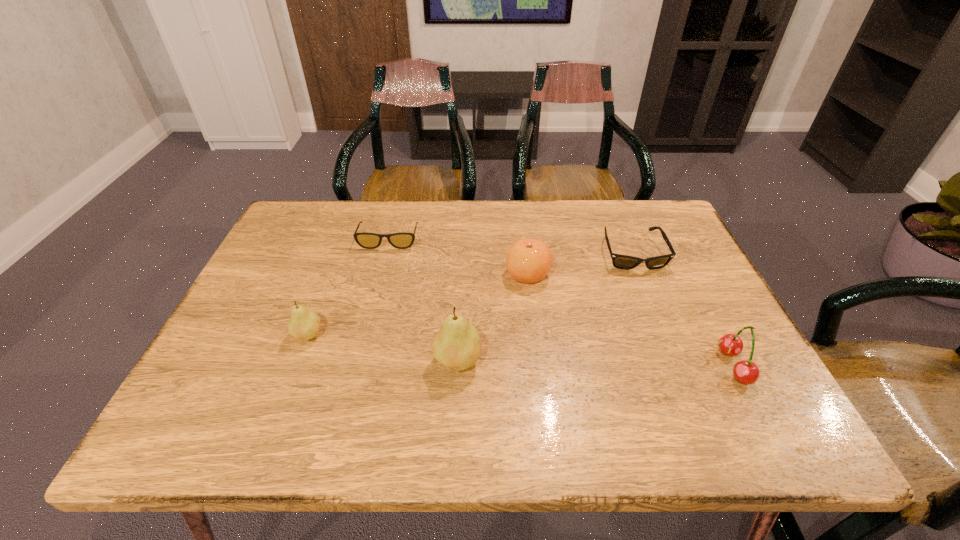
This screenshot has width=960, height=540. I want to click on free space between the left sunglasses and the fourth object from left to right, so click(459, 256).

You are a GUI agent. You are given a task and a screenshot of the screen. Output one action in this format:
    pyautogui.click(x=<x>, y=<y>)
    Task: Click on the free space between the second object from left to right and the right pear
    The height and width of the screenshot is (540, 960).
    Given the screenshot: What is the action you would take?
    pyautogui.click(x=423, y=300)

You are a GUI agent. You are given a task and a screenshot of the screen. Output one action in this format:
    pyautogui.click(x=<x>, y=<y>)
    Task: Click on the free space between the third object from left to right and the cherry
    The width and height of the screenshot is (960, 540).
    Given the screenshot: What is the action you would take?
    pyautogui.click(x=595, y=363)

Where is `vacant area that lies between the left pear and the tallest object`? Image resolution: width=960 pixels, height=540 pixels. vacant area that lies between the left pear and the tallest object is located at coordinates (382, 348).

You are a GUI agent. You are given a task and a screenshot of the screen. Output one action in this format:
    pyautogui.click(x=<x>, y=<y>)
    Task: Click on the free space between the fifth object from left to right and the cherry
    
    Given the screenshot: What is the action you would take?
    pyautogui.click(x=683, y=309)

The height and width of the screenshot is (540, 960). Identify the location of blank region between the leftmost object and the second object from right to left. (470, 294).

Where is `empty space that is in between the left pear and the third object from right to left`? The height and width of the screenshot is (540, 960). empty space that is in between the left pear and the third object from right to left is located at coordinates (418, 305).

Find the location of a particular element. blank region between the left sunglasses and the third object from right to left is located at coordinates (459, 256).

Locate which object ranks in proximity to the shorter pear. Please provide its 2D coordinates. Your answer should be formatted as a tuple, i.e. [(x, y)], where the tuple contains the x and y coordinates of a point satisfying the conditions above.

[(457, 346)]

The width and height of the screenshot is (960, 540). In order to click on object that can be found as the second closest to the second object from right to left in this screenshot , I will do `click(746, 372)`.